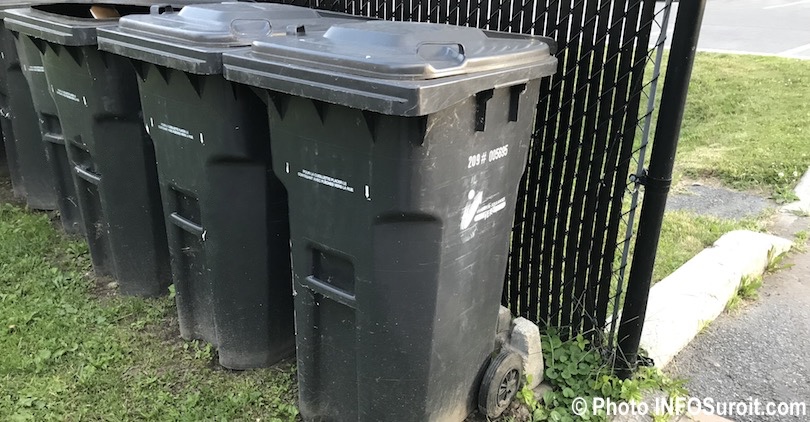
Locate an element on the screen. The image size is (810, 422). trash can is located at coordinates (32, 178), (33, 86), (79, 88), (182, 121), (367, 175).